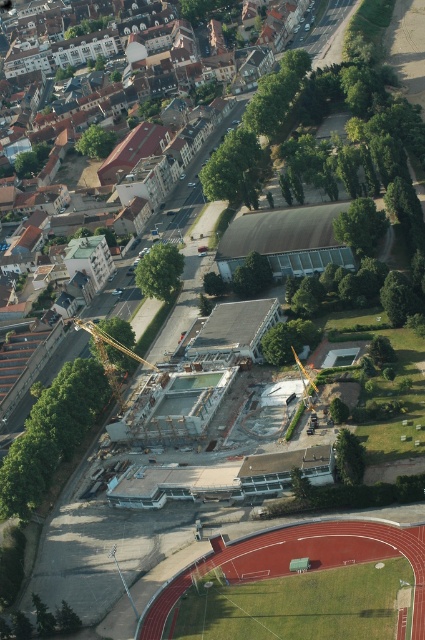
Question: Which object appears closest to the camera in this image?

Choices:
 (A) green grass football field at lower center
 (B) gold metallic crane at center

Answer: (A)

Question: Does green grass football field at lower center appear under gold metallic crane at center?

Choices:
 (A) no
 (B) yes

Answer: (B)

Question: Which point appears farthest from the camera in this image?

Choices:
 (A) (235, 556)
 (B) (105, 364)

Answer: (B)

Question: In this image, where is green grass football field at lower center located relative to gold metallic crane at center?

Choices:
 (A) right
 (B) left

Answer: (A)

Question: Does green grass football field at lower center appear on the left side of gold metallic crane at center?

Choices:
 (A) no
 (B) yes

Answer: (A)